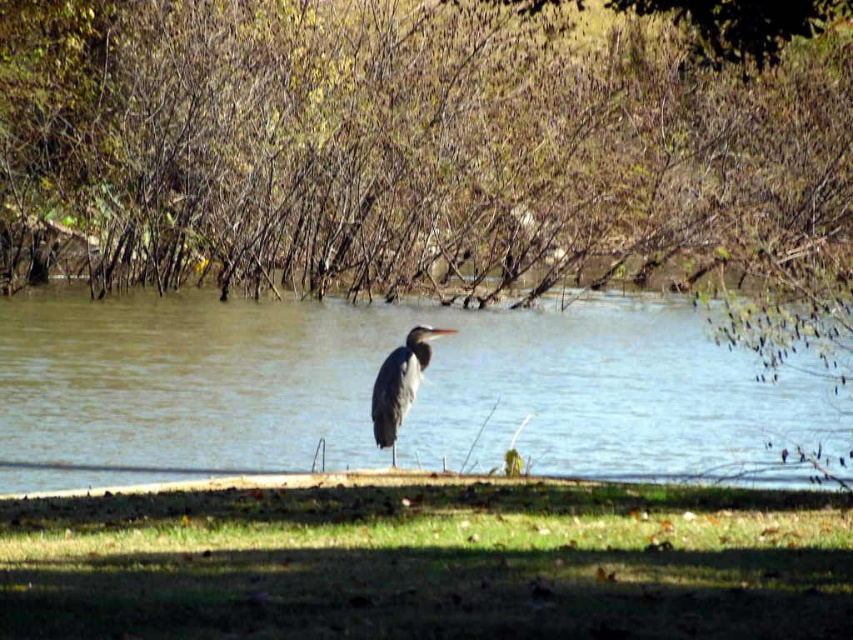
Is point (735, 387) positioned before point (381, 362)?

That is False.

Does clear water at center have a greater height compared to gray matte bird at center?

Correct, clear water at center is much taller as gray matte bird at center.

In order to click on clear water at center in this screenshot , I will do `click(418, 392)`.

Where is `clear water at center`? The height and width of the screenshot is (640, 853). clear water at center is located at coordinates (418, 392).

Is green grass at lower center thinner than clear water at center?

Indeed, green grass at lower center has a lesser width compared to clear water at center.

What are the coordinates of `green grass at lower center` in the screenshot? It's located at (428, 563).

At what (x,y) coordinates should I click in order to perform the action: click on green grass at lower center. Please return your answer as a coordinate pair (x, y). Looking at the image, I should click on (428, 563).

Which is above, green grass at lower center or gray matte bird at center?

gray matte bird at center is higher up.

Does point (808, 609) come behind point (427, 356)?

No, it is in front of (427, 356).

This screenshot has height=640, width=853. In order to click on green grass at lower center in this screenshot , I will do `click(428, 563)`.

The width and height of the screenshot is (853, 640). Find the location of `green grass at lower center`. green grass at lower center is located at coordinates (428, 563).